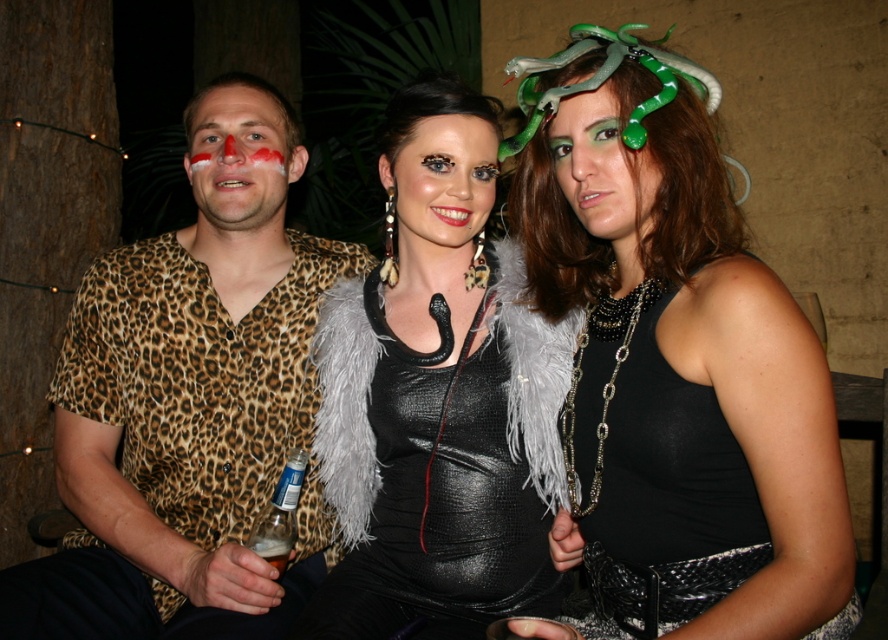
You are a photographer setting up for a group photo. You need to ensure that the black leather dress at center and the translucent plastic bottle at lower left are both visible in the frame. Based on their sizes, which object should you focus on first to ensure proper exposure?

The black leather dress at center has a greater height compared to the translucent plastic bottle at lower left, so you should focus on the black leather dress at center first to ensure proper exposure since it is larger and more prominent in the scene.

You are a photographer at the event and want to take a photo of both the leopard print shirt at left and the green matte snake headband at center. However, you need to ensure that neither object is blocked by the other. Based on their positions, which object should you adjust to avoid overlap?

The green matte snake headband at center is behind the leopard print shirt at left, so you should move the leopard print shirt at left slightly forward or the green matte snake headband at center slightly backward to ensure both are visible without obstruction.